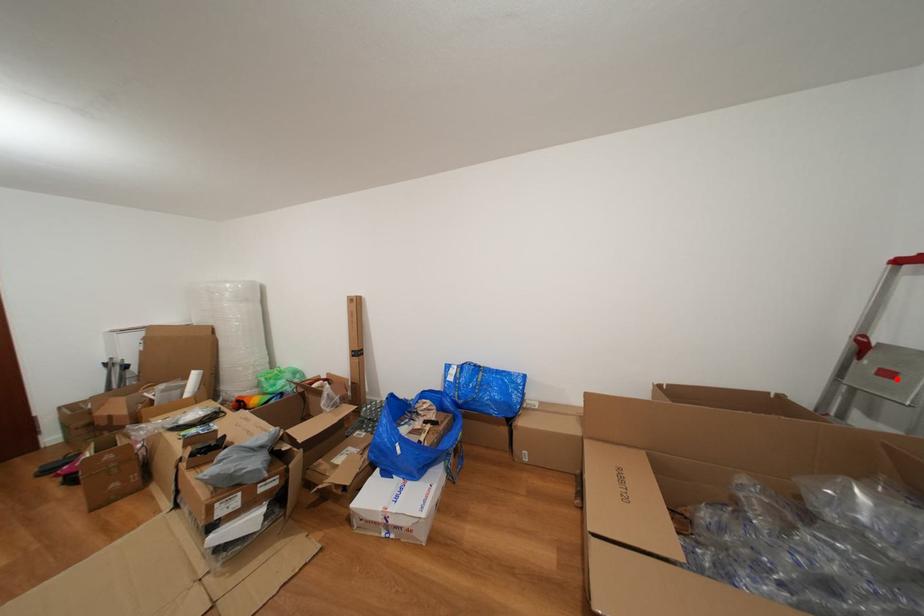
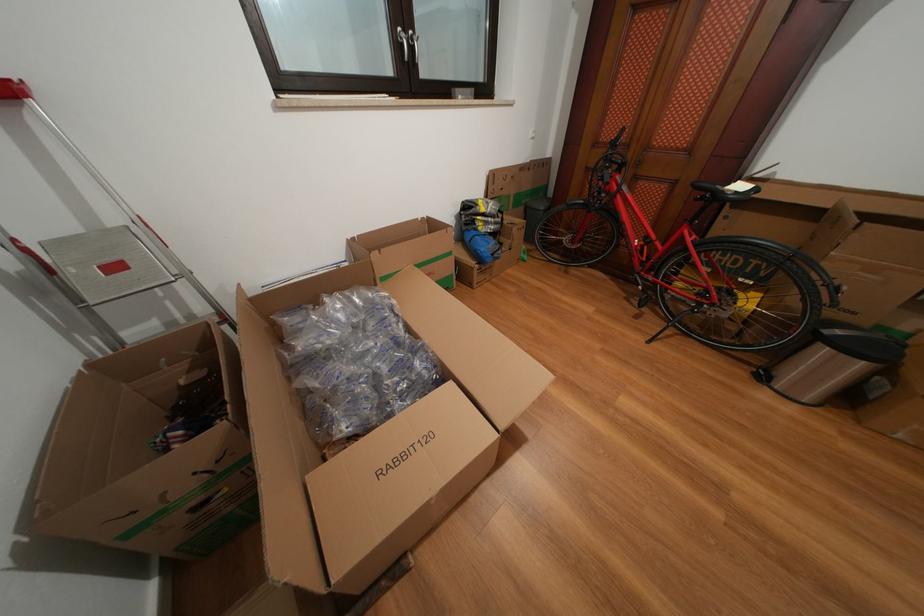
Question: I am providing you with two images of the same scene from different viewpoints. A red point is shown in image1. For the corresponding object point in image2, is it positioned nearer or farther from the camera?

Choices:
 (A) Nearer
 (B) Farther

Answer: (B)